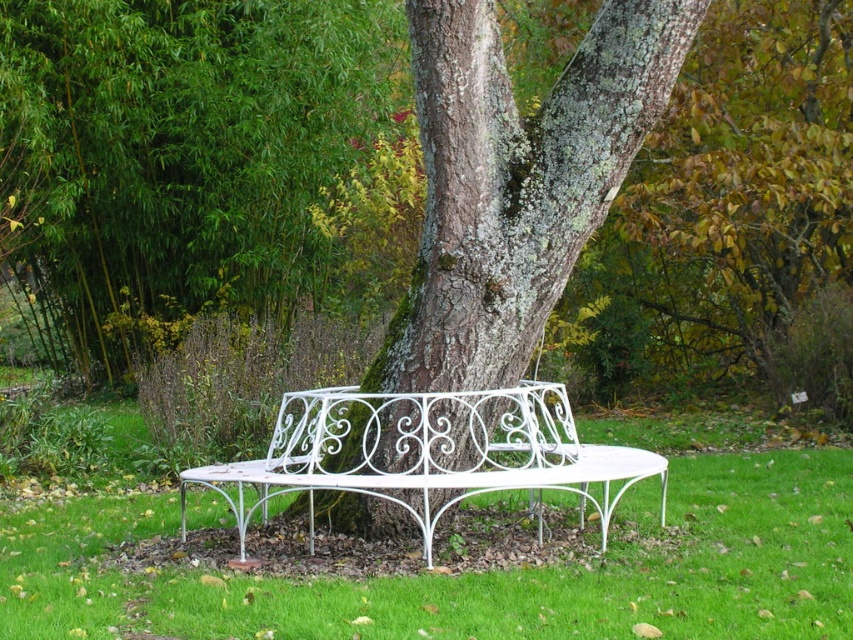
You are a gardener planning to trim the green bamboo at left and the green mossy bark at center. Which object requires more attention to avoid damaging its structure?

The green bamboo at left requires more attention because it is bigger than the green mossy bark at center, so it may need more careful trimming to avoid damaging its structure.